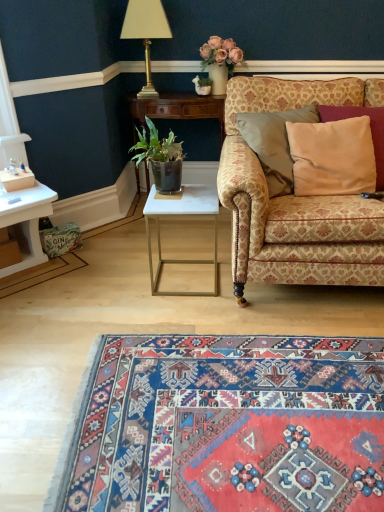
Where is `vacant space to the left of white marble table at center, which is the second table in top-to-bottom order`? vacant space to the left of white marble table at center, which is the second table in top-to-bottom order is located at coordinates (120, 282).